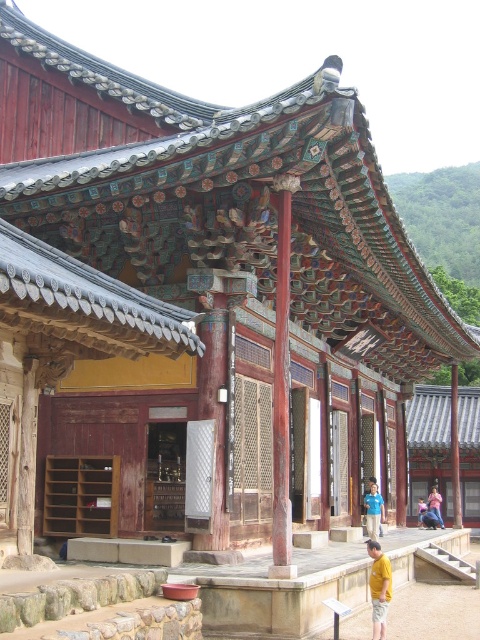
Question: Is pink fabric person at center positioned in front of light blue shirt at center?

Choices:
 (A) no
 (B) yes

Answer: (B)

Question: From the image, what is the correct spatial relationship of wooden door at center in relation to pink fabric person at center?

Choices:
 (A) left
 (B) right

Answer: (A)

Question: Can you confirm if yellow cotton shirt at lower right is smaller than pink fabric person at center?

Choices:
 (A) no
 (B) yes

Answer: (A)

Question: Which point is closer to the camera?

Choices:
 (A) light blue shirt at center
 (B) wooden door at center
 (C) yellow cotton shirt at lower right

Answer: (C)

Question: Which of the following is the closest to the observer?

Choices:
 (A) pink fabric person at center
 (B) blue fabric shirt at center
 (C) yellow cotton shirt at lower right

Answer: (C)

Question: Which point appears farthest from the camera in this image?

Choices:
 (A) (287, 384)
 (B) (183, 490)

Answer: (B)